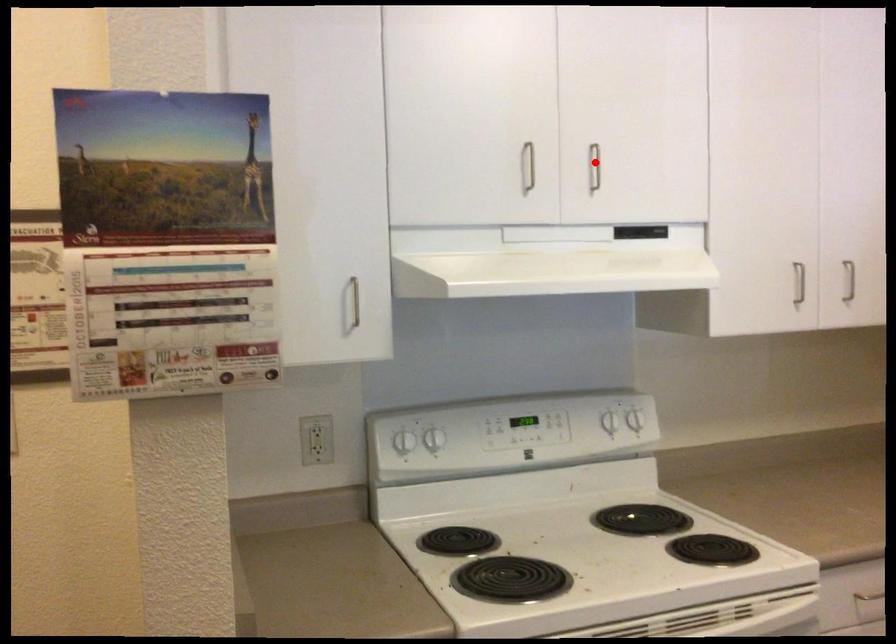
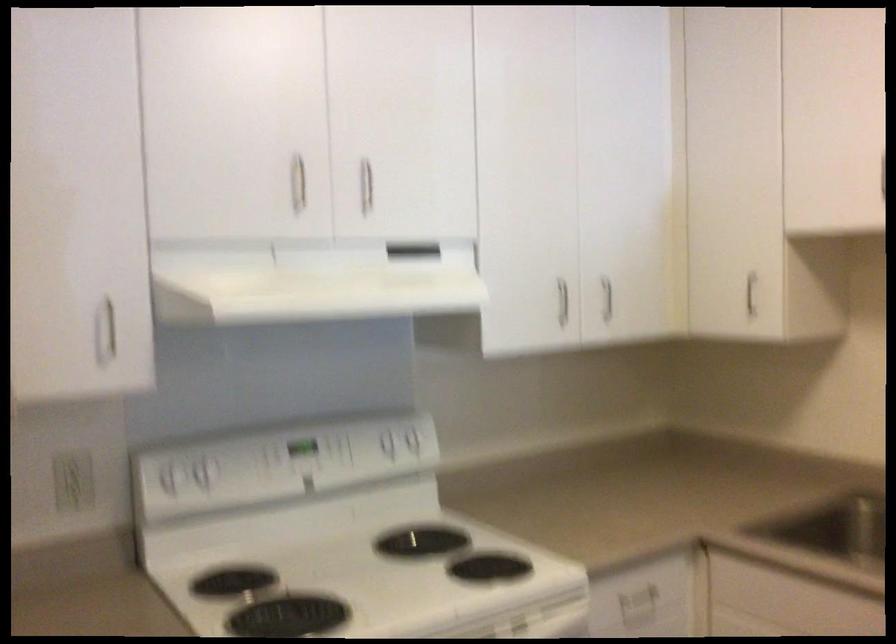
In the second image, find the point that corresponds to the highlighted location in the first image.

(366, 185)